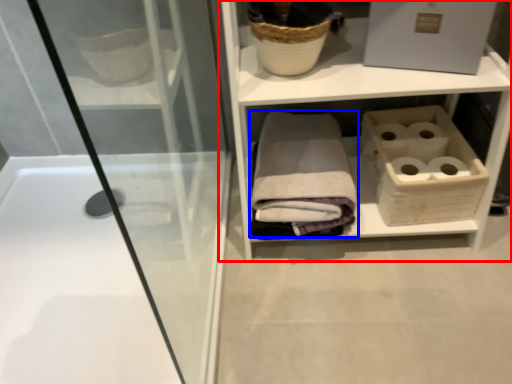
Question: Which of the following is the closest to the observer, shelf (highlighted by a red box) or bath towel (highlighted by a blue box)?

Choices:
 (A) shelf
 (B) bath towel

Answer: (A)